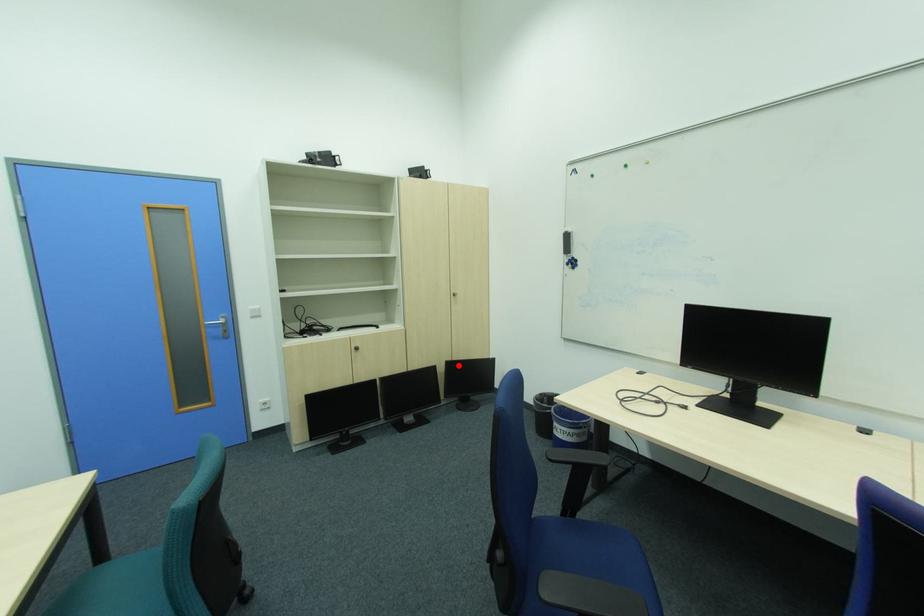
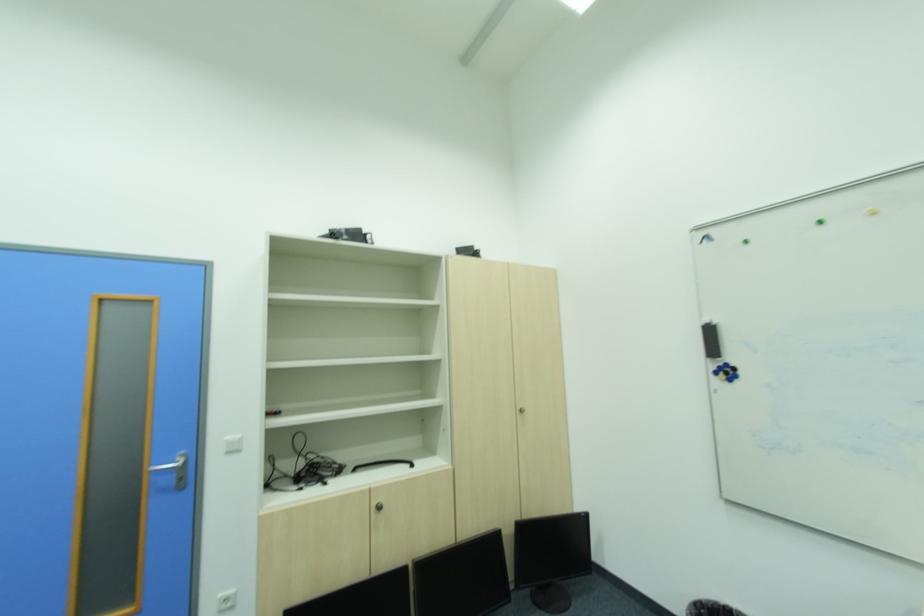
The point at the highlighted location is marked in the first image. Where is the corresponding point in the second image?

(531, 531)